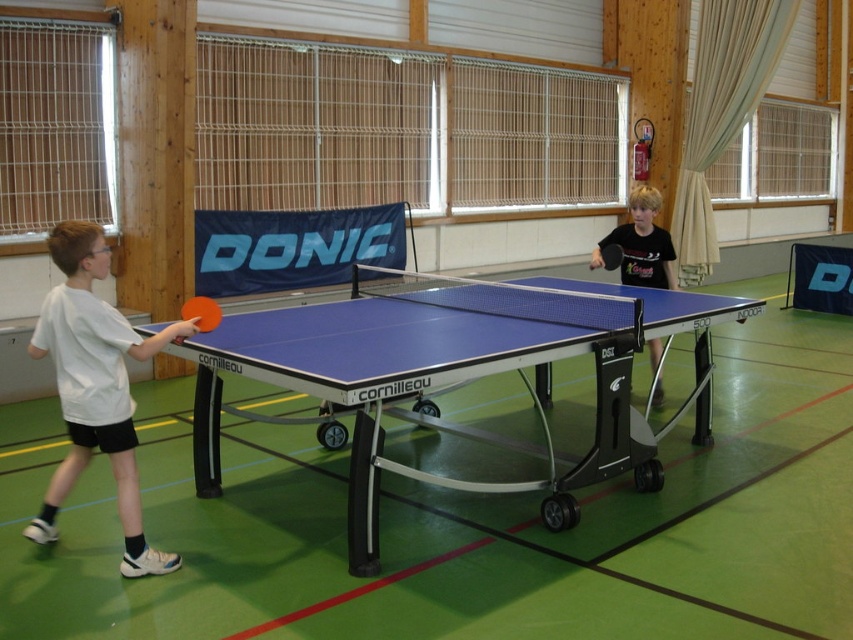
In the scene shown: Which is more to the right, blue glossy ping pong table at center or white matte shirt at left?

blue glossy ping pong table at center

Who is more forward, [722,300] or [76,289]?

Positioned in front is point [76,289].

Locate an element on the screen. blue glossy ping pong table at center is located at coordinates (459, 372).

Is the position of blue glossy table tennis table at center less distant than that of rubber paddle at center?

Yes, blue glossy table tennis table at center is in front of rubber paddle at center.

Can you confirm if blue glossy table tennis table at center is thinner than rubber paddle at center?

Yes.

Measure the distance between point (213, 326) and camera.

Point (213, 326) is 12.51 feet from camera.

Locate an element on the screen. Image resolution: width=853 pixels, height=640 pixels. blue glossy table tennis table at center is located at coordinates (201, 312).

Is point (258, 324) positioned behind point (593, 250)?

No, (258, 324) is closer to viewer.

Which is more to the right, blue glossy ping pong table at center or rubber paddle at center?

rubber paddle at center is more to the right.

The image size is (853, 640). I want to click on blue glossy ping pong table at center, so click(459, 372).